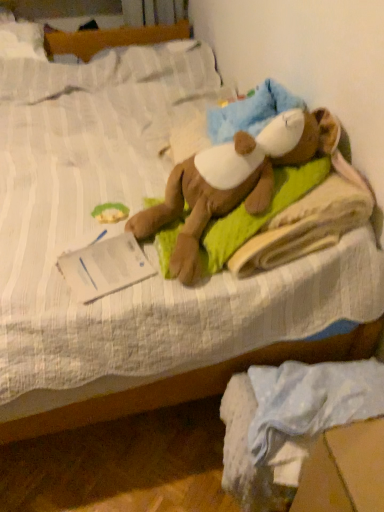
Question: From the image's perspective, is soft brown plush toy at center above or below green fabric at upper left?

Choices:
 (A) above
 (B) below

Answer: (A)

Question: In terms of size, does soft brown plush toy at center appear bigger or smaller than green fabric at upper left?

Choices:
 (A) big
 (B) small

Answer: (A)

Question: Estimate the real-world distances between objects in this image. Which object is farther from the green fabric at upper left?

Choices:
 (A) white cotton fabric at lower right
 (B) soft brown plush toy at center

Answer: (A)

Question: Estimate the real-world distances between objects in this image. Which object is closer to the soft brown plush toy at center?

Choices:
 (A) green fabric at upper left
 (B) white cotton fabric at lower right

Answer: (A)